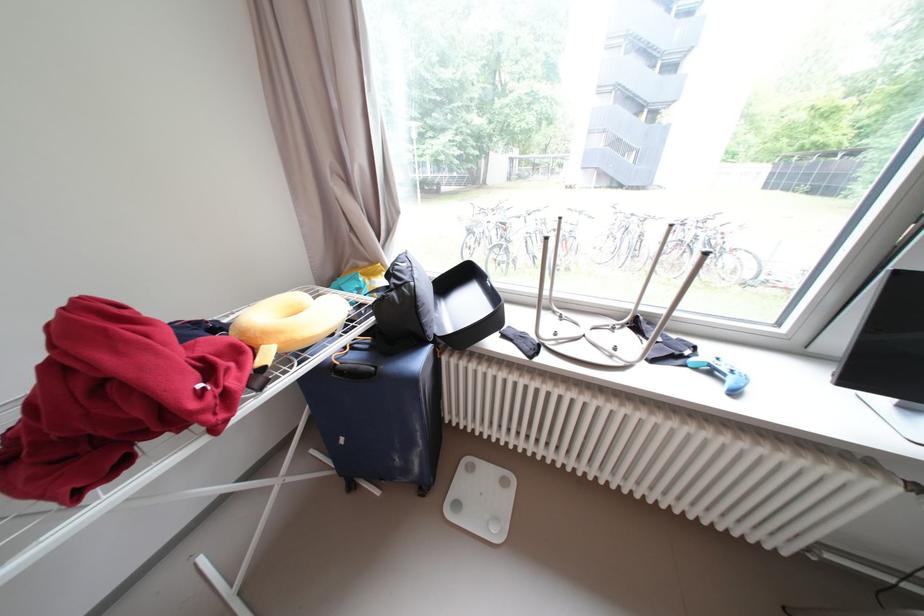
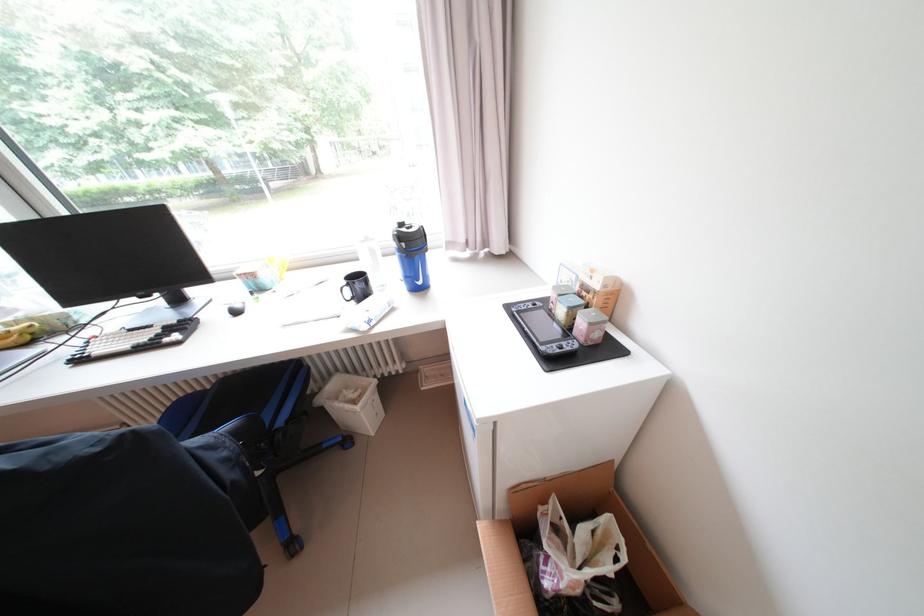
Question: I am providing you with two images of the same scene from different viewpoints. After the viewpoint changes to image2, which objects are now occluded?

Choices:
 (A) blue suitcase handle
 (B) yellow banana
 (C) white trash can
 (D) white paper sheets

Answer: (A)